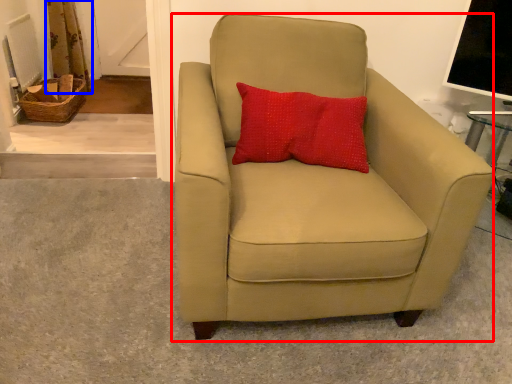
Question: Which object appears closest to the camera in this image, chair (highlighted by a red box) or curtain (highlighted by a blue box)?

Choices:
 (A) chair
 (B) curtain

Answer: (A)